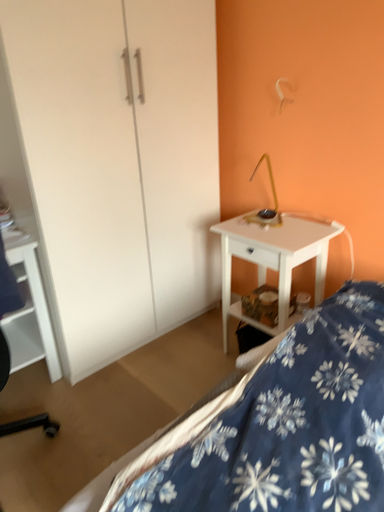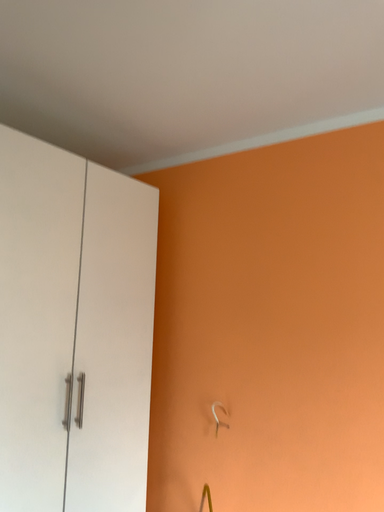
Question: Which way did the camera rotate in the video?

Choices:
 (A) rotated left
 (B) rotated right

Answer: (B)